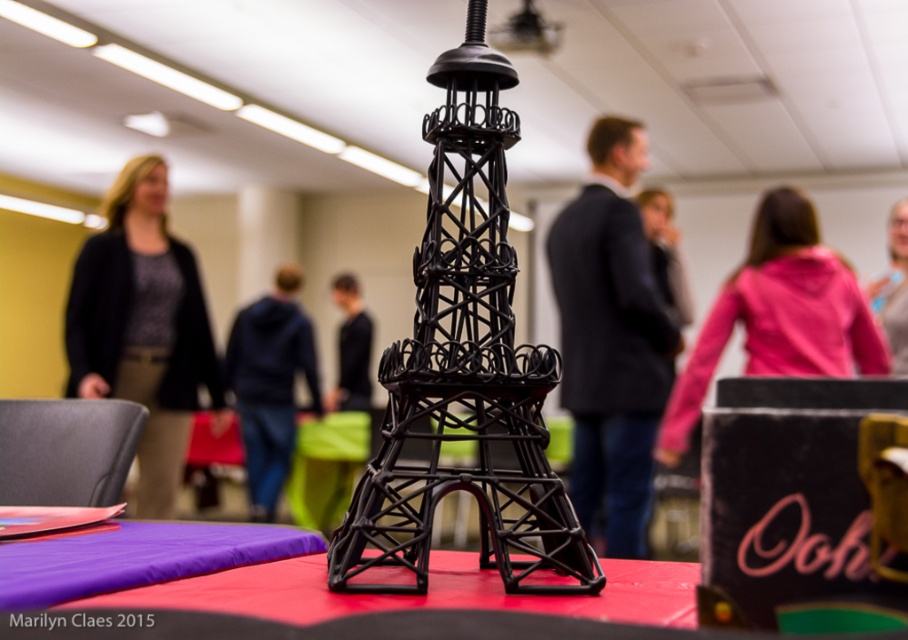
Question: Can you confirm if black matte eiffel tower at center is positioned above dark suit jacket at center?

Choices:
 (A) yes
 (B) no

Answer: (B)

Question: Which point appears farthest from the camera in this image?

Choices:
 (A) (363, 376)
 (B) (139, 396)
 (C) (277, 612)

Answer: (A)

Question: Which point is closer to the camera taking this photo?

Choices:
 (A) (835, 260)
 (B) (338, 304)

Answer: (A)

Question: Which is nearer to the purple fabric at lower left?

Choices:
 (A) rubberized red tablecloth at center
 (B) dark suit jacket at center

Answer: (A)

Question: Can you confirm if black matte eiffel tower at center is thinner than dark suit jacket at center?

Choices:
 (A) yes
 (B) no

Answer: (A)

Question: Can you confirm if pink fabric at center is positioned to the left of purple fabric at lower left?

Choices:
 (A) yes
 (B) no

Answer: (B)